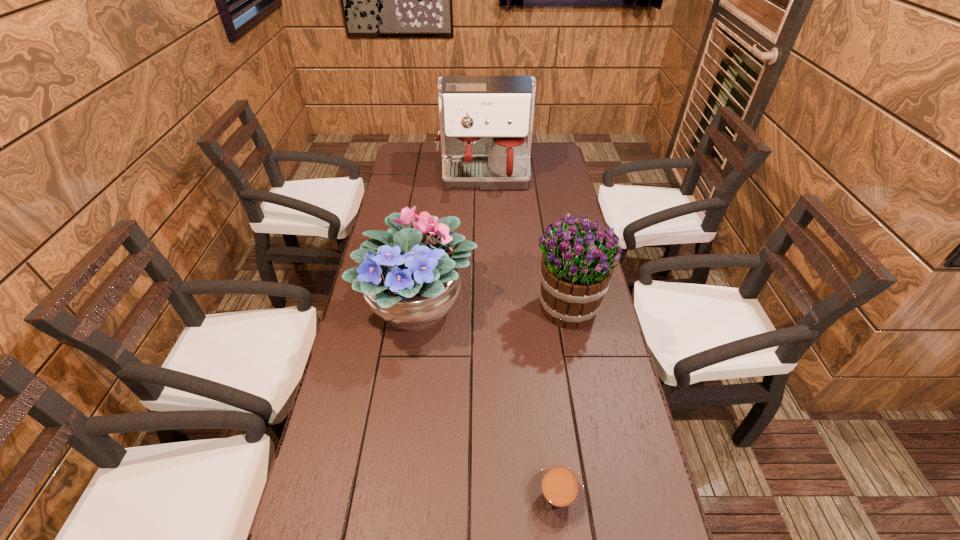
Locate an element on the screen. free point that satisfies the following two spatial constraints: 1. on the front side of the left bouquet; 2. on the left side of the nearest object is located at coordinates (393, 496).

The height and width of the screenshot is (540, 960). Find the location of `free space that satisfies the following two spatial constraints: 1. on the front of the right bouquet near the spout; 2. on the left side of the farthest object`. free space that satisfies the following two spatial constraints: 1. on the front of the right bouquet near the spout; 2. on the left side of the farthest object is located at coordinates (486, 307).

This screenshot has height=540, width=960. What are the coordinates of `vacant region that satisfies the following two spatial constraints: 1. on the front side of the left bouquet; 2. on the left side of the nearest object` in the screenshot? It's located at (393, 496).